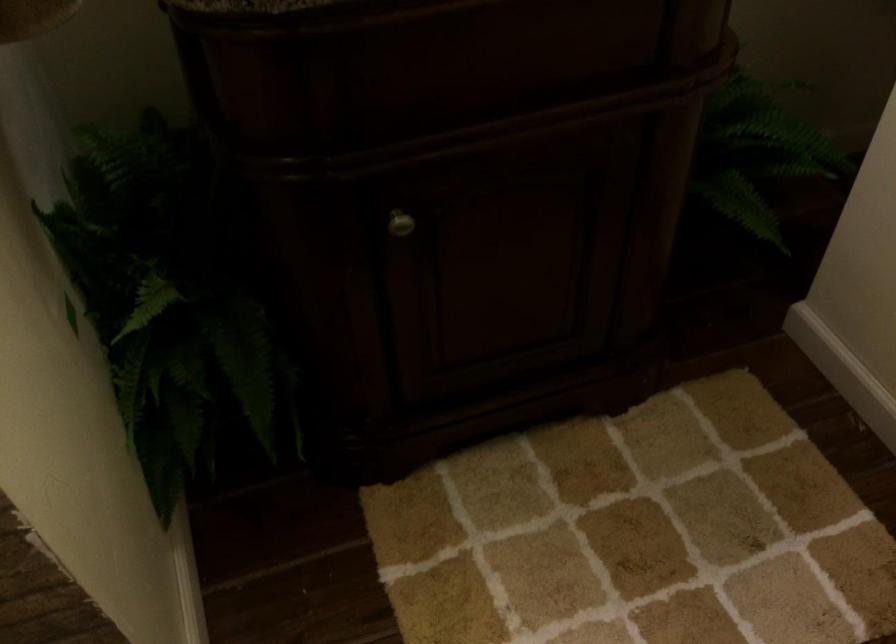
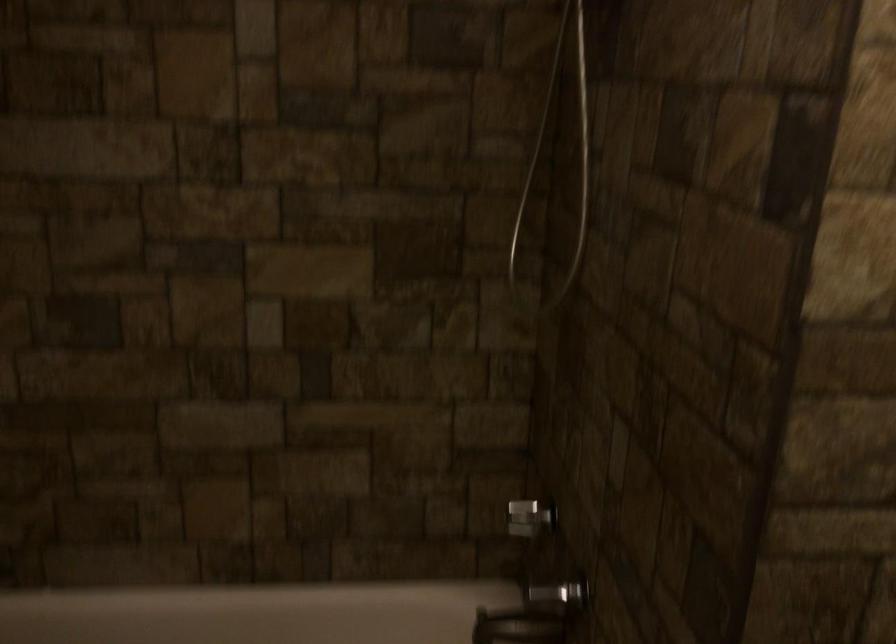
Question: Based on the continuous images, in which direction is the camera rotating? Reply with the corresponding letter.

Choices:
 (A) Left
 (B) Right
 (C) Up
 (D) Down

Answer: (C)